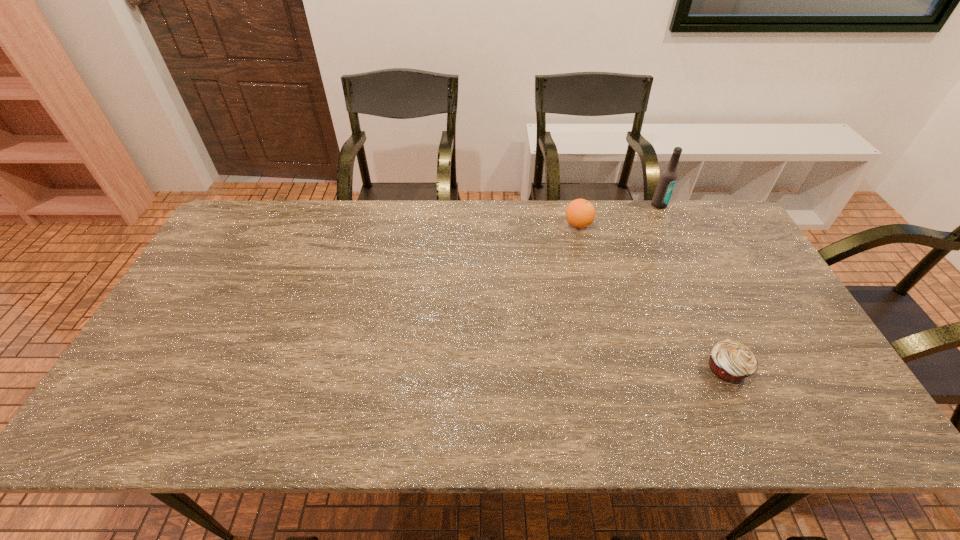
At what (x,y) coordinates should I click in order to perform the action: click on the tallest object. Please return your answer as a coordinate pair (x, y). This screenshot has width=960, height=540. Looking at the image, I should click on (667, 180).

You are a GUI agent. You are given a task and a screenshot of the screen. Output one action in this format:
    pyautogui.click(x=<x>, y=<y>)
    Task: Click on the farthest object
    The width and height of the screenshot is (960, 540).
    Given the screenshot: What is the action you would take?
    pyautogui.click(x=667, y=180)

Locate an element on the screen. The image size is (960, 540). the second farthest object is located at coordinates (580, 213).

At what (x,y) coordinates should I click in order to perform the action: click on orange. Please return your answer as a coordinate pair (x, y). Looking at the image, I should click on (580, 213).

You are a GUI agent. You are given a task and a screenshot of the screen. Output one action in this format:
    pyautogui.click(x=<x>, y=<y>)
    Task: Click on the nearest object
    
    Given the screenshot: What is the action you would take?
    pyautogui.click(x=731, y=361)

At what (x,y) coordinates should I click in order to perform the action: click on vacant space located 0.400m on the side of the beer bottle with the label. Please return your answer as a coordinate pair (x, y). The image size is (960, 540). Looking at the image, I should click on (702, 295).

Locate an element on the screen. The image size is (960, 540). vacant space located 0.070m on the back of the orange is located at coordinates (573, 203).

The image size is (960, 540). What are the coordinates of `free region located 0.260m on the back of the muffin` in the screenshot? It's located at pyautogui.click(x=685, y=278).

Identify the location of beer bottle present at the far edge. Image resolution: width=960 pixels, height=540 pixels. (667, 180).

Where is `orange that is at the far edge`? orange that is at the far edge is located at coordinates (580, 213).